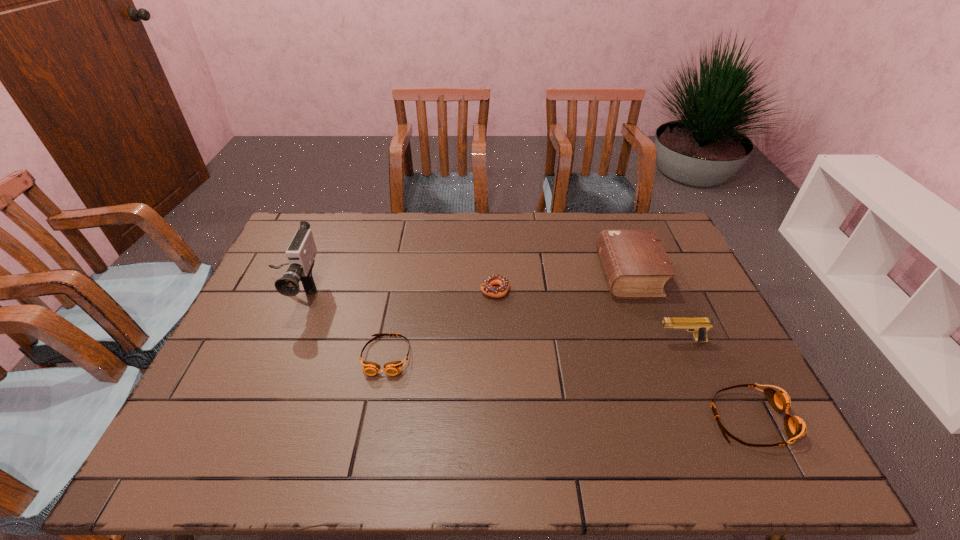
This screenshot has width=960, height=540. I want to click on vacant region located on the spine side of the Bible, so click(x=486, y=274).

This screenshot has height=540, width=960. I want to click on free space located 0.160m on the spine side of the Bible, so click(550, 274).

Locate an element on the screen. vacant space located 0.200m on the spine side of the Bible is located at coordinates (539, 274).

Image resolution: width=960 pixels, height=540 pixels. I want to click on vacant space located on the recording direction of the camcorder, so click(262, 361).

Identify the location of free spot located 0.270m at the barrel of the pistol. (558, 341).

Identify the location of vacant space located 0.160m at the barrel of the pistol. This screenshot has height=540, width=960. (598, 341).

The width and height of the screenshot is (960, 540). I want to click on vacant space positioned at the barrel of the pistol, so click(x=612, y=341).

Identify the location of vacant area situated on the back of the doughnut. This screenshot has width=960, height=540. (492, 233).

What are the coordinates of `object situated at the far edge` in the screenshot? It's located at (636, 266).

This screenshot has height=540, width=960. What are the coordinates of `object that is at the near edge` in the screenshot? It's located at (795, 427).